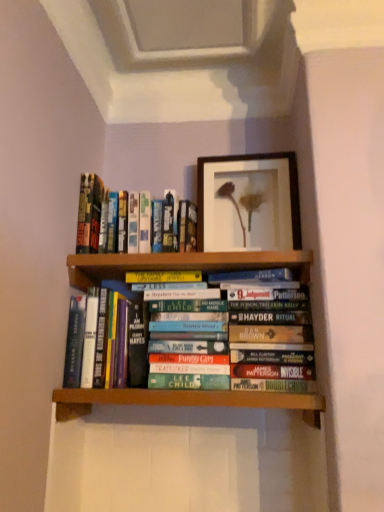
Question: Is point (69, 366) positioned closer to the camera than point (274, 182)?

Choices:
 (A) farther
 (B) closer

Answer: (B)

Question: In terms of size, does hardcover book at center, the first book when ordered from bottom to top, appear bigger or smaller than wooden framed picture at upper center?

Choices:
 (A) big
 (B) small

Answer: (A)

Question: Based on their relative distances, which object is nearer to the wooden framed picture at upper center?

Choices:
 (A) hardcover book at center, the first book when ordered from bottom to top
 (B) hardcover books at upper left, the 1th book viewed from the top

Answer: (B)

Question: Based on their relative distances, which object is nearer to the hardcover books at upper left, the second book positioned from the bottom?

Choices:
 (A) wooden framed picture at upper center
 (B) hardcover book at center, positioned as the 2th book in top-to-bottom order

Answer: (B)